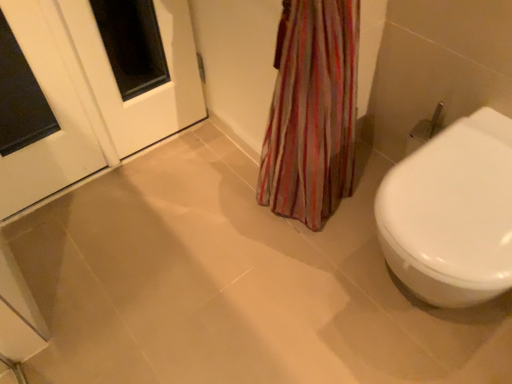
Locate an element on the screen. Image resolution: width=512 pixels, height=384 pixels. free space in front of white glossy door at upper left is located at coordinates (59, 245).